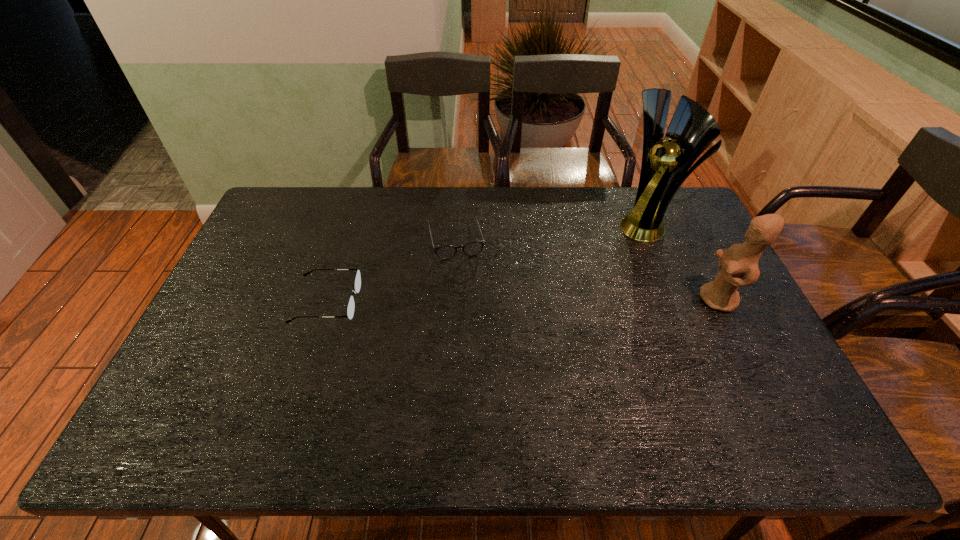
Find the location of `vacant point located at the front of the tallest object, where the globe is visible`. vacant point located at the front of the tallest object, where the globe is visible is located at coordinates (582, 269).

Locate an element on the screen. vacant area situated at the front of the tallest object, where the globe is visible is located at coordinates pos(588,265).

Where is `free space located at the front of the tallest object, where the globe is visible`? The image size is (960, 540). free space located at the front of the tallest object, where the globe is visible is located at coordinates (575, 274).

I want to click on free location located 0.300m through the lenses of the right spectacles, so coord(481,337).

The height and width of the screenshot is (540, 960). I want to click on vacant area situated through the lenses of the right spectacles, so click(475, 317).

Image resolution: width=960 pixels, height=540 pixels. In order to click on vacant area located through the lenses of the right spectacles in this screenshot , I will do `click(473, 309)`.

I want to click on award positioned at the far edge, so click(x=665, y=165).

Locate an element on the screen. The height and width of the screenshot is (540, 960). spectacles that is at the far edge is located at coordinates (445, 252).

You are a GUI agent. You are given a task and a screenshot of the screen. Output one action in this format:
    pyautogui.click(x=<x>, y=<y>)
    Task: Click on the figurine at the right edge
    Image resolution: width=960 pixels, height=540 pixels.
    Given the screenshot: What is the action you would take?
    pyautogui.click(x=739, y=260)

Identify the location of award located in the right edge section of the desktop. Image resolution: width=960 pixels, height=540 pixels. (665, 165).